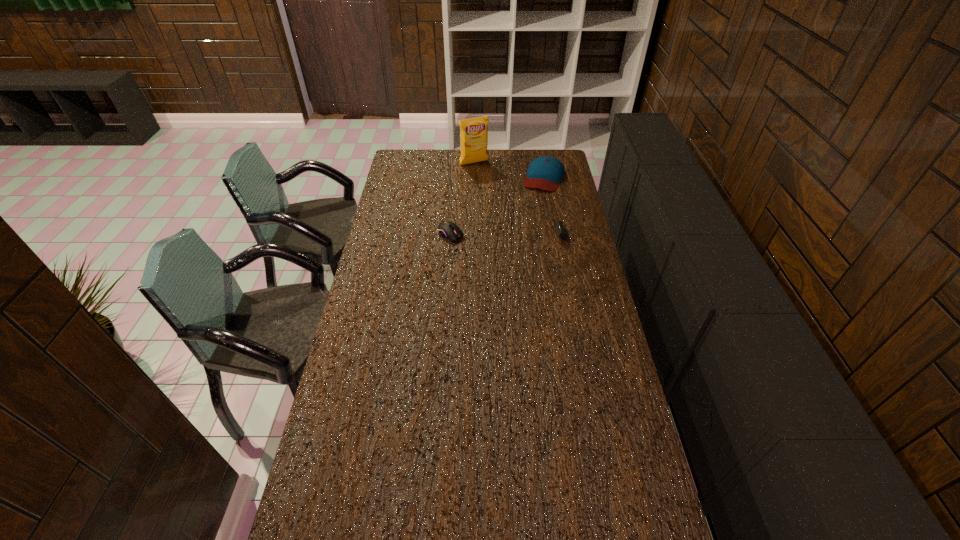
Where is `free location located 0.090m on the front of the tallest object with the logo`? This screenshot has width=960, height=540. free location located 0.090m on the front of the tallest object with the logo is located at coordinates (485, 176).

Locate an element on the screen. The height and width of the screenshot is (540, 960). blank space located with the bill of the second tallest object facing forward is located at coordinates (536, 202).

Where is `vacant space situated 0.360m with the bill of the second tallest object facing forward`? The image size is (960, 540). vacant space situated 0.360m with the bill of the second tallest object facing forward is located at coordinates click(x=521, y=237).

I want to click on vacant space situated 0.370m with the bill of the second tallest object facing forward, so click(521, 238).

Find the location of a particular element. Image resolution: width=960 pixels, height=540 pixels. crisp (potato chip) at the far edge is located at coordinates [x=473, y=132].

You are a GUI agent. You are given a task and a screenshot of the screen. Output one action in this format:
    pyautogui.click(x=<x>, y=<y>)
    Task: Click on the baseball cap present at the far edge
    This screenshot has height=540, width=960.
    Given the screenshot: What is the action you would take?
    pyautogui.click(x=545, y=172)

You are a GUI agent. You are given a task and a screenshot of the screen. Output one action in this format:
    pyautogui.click(x=<x>, y=<y>)
    Task: Click on the webcam that is at the right edge
    
    Given the screenshot: What is the action you would take?
    pyautogui.click(x=561, y=231)

The width and height of the screenshot is (960, 540). In order to click on baseball cap that is positioned at the right edge in this screenshot , I will do `click(545, 172)`.

I want to click on object that is at the far right corner, so click(x=545, y=172).

Where is `vacant region at the far edge of the desktop`? This screenshot has width=960, height=540. vacant region at the far edge of the desktop is located at coordinates (517, 156).